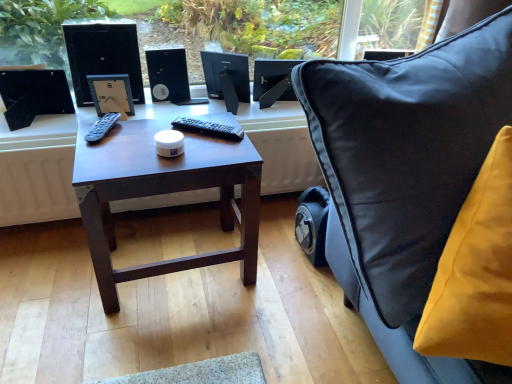
You are a GUI agent. You are given a task and a screenshot of the screen. Output one action in this format:
    pyautogui.click(x=<x>, y=<y>)
    Task: Click on the empty space that is to the right of dark wood table at center
    
    Given the screenshot: What is the action you would take?
    pyautogui.click(x=286, y=289)